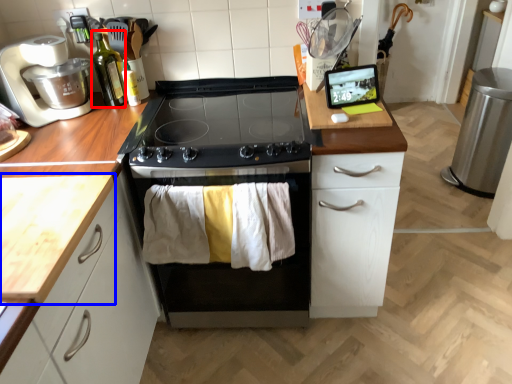
Question: Among these objects, which one is nearest to the camera, bottle (highlighted by a red box) or countertop (highlighted by a blue box)?

Choices:
 (A) bottle
 (B) countertop

Answer: (B)